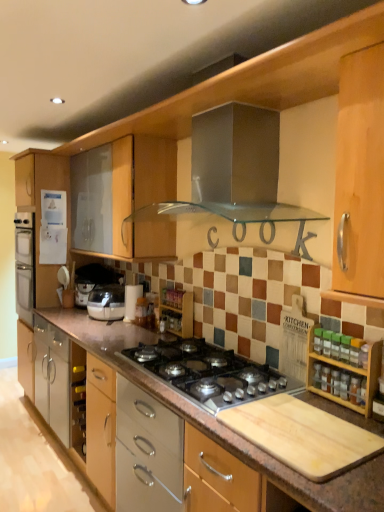
I want to click on wooden spice rack at right, positioned as the 2th cabinetry in bottom-to-top order, so click(x=345, y=375).

The image size is (384, 512). What do you see at coordinates (177, 311) in the screenshot? I see `wooden spice rack at center` at bounding box center [177, 311].

The height and width of the screenshot is (512, 384). Describe the element at coordinates (107, 302) in the screenshot. I see `matte white blender at center` at that location.

The image size is (384, 512). I want to click on matte white blender at center, so click(x=107, y=302).

Describe the element at coordinates (53, 228) in the screenshot. This screenshot has width=384, height=512. I see `white paper refrigerator at left, the 3th appliance when ordered from front to back` at that location.

Where is `white paper towel holder at center, positioned as the 1th appliance in front-to-back order`? This screenshot has height=512, width=384. white paper towel holder at center, positioned as the 1th appliance in front-to-back order is located at coordinates (131, 300).

Can you tell me how much wooden spice rack at center and satin silver toaster at lower left, the 2th appliance in the bottom-to-top sequence, differ in facing direction?

1.28 degrees.

Which of these two, wooden spice rack at center or satin silver toaster at lower left, the 2th appliance in the bottom-to-top sequence, is wider?

With larger width is satin silver toaster at lower left, the 2th appliance in the bottom-to-top sequence.

Where is `shelf that is in front of the satin silver toaster at lower left, the 2th appliance in the bottom-to-top sequence`? This screenshot has height=512, width=384. shelf that is in front of the satin silver toaster at lower left, the 2th appliance in the bottom-to-top sequence is located at coordinates click(177, 311).

Is wooden spice rack at center next to satin silver toaster at lower left, arranged as the 2th appliance when viewed from the front, and touching it?

No, wooden spice rack at center is not beside satin silver toaster at lower left, arranged as the 2th appliance when viewed from the front.

Are satin silver gas stove at center and white paper towel holder at center, acting as the 3th appliance starting from the left, far apart?

No, there isn't a large distance between satin silver gas stove at center and white paper towel holder at center, acting as the 3th appliance starting from the left.

Is white paper towel holder at center, positioned as the 1th appliance in front-to-back order, completely or partially inside satin silver gas stove at center?

No, white paper towel holder at center, positioned as the 1th appliance in front-to-back order, is not a part of satin silver gas stove at center.

From the image's perspective, is satin silver gas stove at center beneath white paper towel holder at center, the first appliance when ordered from right to left?

Yes.

Considering the sizes of satin silver gas stove at center and white paper towel holder at center, acting as the 1th appliance starting from the bottom, in the image, is satin silver gas stove at center bigger or smaller than white paper towel holder at center, acting as the 1th appliance starting from the bottom,?

satin silver gas stove at center is bigger than white paper towel holder at center, acting as the 1th appliance starting from the bottom.

From a real-world perspective, which object stands above the other?

white paper refrigerator at left, arranged as the third appliance when ordered from the bottom.

Considering the sizes of objects matte silver cabinet at lower center, which is the 1th cabinetry in left-to-right order, and white paper refrigerator at left, the 1th appliance when ordered from top to bottom, in the image provided, who is bigger, matte silver cabinet at lower center, which is the 1th cabinetry in left-to-right order, or white paper refrigerator at left, the 1th appliance when ordered from top to bottom,?

Bigger between the two is matte silver cabinet at lower center, which is the 1th cabinetry in left-to-right order.

How distant is matte silver cabinet at lower center, the 2th cabinetry when ordered from front to back, from white paper refrigerator at left, the 3th appliance from the right?

matte silver cabinet at lower center, the 2th cabinetry when ordered from front to back, and white paper refrigerator at left, the 3th appliance from the right, are 1.37 meters apart.

From the image's perspective, starting from the white paper refrigerator at left, arranged as the third appliance when ordered from the bottom, which cabinetry is the 2nd one below? Please provide its 2D coordinates.

[(150, 431)]

Considering the sizes of white paper refrigerator at left, the 1th appliance when ordered from top to bottom, and satin silver gas stove at center in the image, is white paper refrigerator at left, the 1th appliance when ordered from top to bottom, wider or thinner than satin silver gas stove at center?

Clearly, white paper refrigerator at left, the 1th appliance when ordered from top to bottom, has less width compared to satin silver gas stove at center.

Measure the distance from white paper refrigerator at left, the 3th appliance when ordered from front to back, to satin silver gas stove at center.

→ white paper refrigerator at left, the 3th appliance when ordered from front to back, and satin silver gas stove at center are 1.73 meters apart from each other.

From a real-world perspective, is white paper refrigerator at left, the 1th appliance when ordered from top to bottom, positioned above or below satin silver gas stove at center?

In terms of real-world spatial position, white paper refrigerator at left, the 1th appliance when ordered from top to bottom, is above satin silver gas stove at center.

From the image's perspective, is white paper refrigerator at left, the 3th appliance from the right, on top of satin silver gas stove at center?

Indeed, from the image's perspective, white paper refrigerator at left, the 3th appliance from the right, is shown above satin silver gas stove at center.

Can we say matte white blender at center lies outside wooden spice rack at center?

Yes, matte white blender at center is outside of wooden spice rack at center.

Which of these two, matte white blender at center or wooden spice rack at center, is wider?

matte white blender at center is wider.

From the image's perspective, who appears lower, matte white blender at center or wooden spice rack at center?

From the image's view, wooden spice rack at center is below.

The height and width of the screenshot is (512, 384). What are the coordinates of `home appliance located above the wooden spice rack at center (from the image's perspective)` in the screenshot? It's located at (107, 302).

Between wooden spice rack at center and matte white blender at center, which one is positioned behind?

matte white blender at center is more distant.

Looking at this image, what's the angular difference between wooden spice rack at center and matte white blender at center's facing directions?

wooden spice rack at center and matte white blender at center are facing 1.28 degrees away from each other.

From the image's perspective, is wooden spice rack at center positioned above or below matte white blender at center?

From the image's perspective, wooden spice rack at center appears below matte white blender at center.

From a real-world perspective, does matte silver cabinet at lower center, the 2th cabinetry when ordered from front to back, sit lower than wooden spice rack at right, positioned as the 2th cabinetry in bottom-to-top order?

Indeed, from a real-world perspective, matte silver cabinet at lower center, the 2th cabinetry when ordered from front to back, is positioned beneath wooden spice rack at right, positioned as the 2th cabinetry in bottom-to-top order.

Is matte silver cabinet at lower center, the 2th cabinetry when ordered from front to back, facing towards wooden spice rack at right, marked as the first cabinetry in a right-to-left arrangement?

No, matte silver cabinet at lower center, the 2th cabinetry when ordered from front to back, is not aimed at wooden spice rack at right, marked as the first cabinetry in a right-to-left arrangement.

Is matte silver cabinet at lower center, the 2th cabinetry when ordered from front to back, touching wooden spice rack at right, positioned as the 2th cabinetry in bottom-to-top order?

There is a gap between matte silver cabinet at lower center, the 2th cabinetry when ordered from front to back, and wooden spice rack at right, positioned as the 2th cabinetry in bottom-to-top order.

Would you say matte silver cabinet at lower center, the 2th cabinetry when ordered from front to back, contains wooden spice rack at right, marked as the 1th cabinetry in a front-to-back arrangement?

That's incorrect, wooden spice rack at right, marked as the 1th cabinetry in a front-to-back arrangement, is not inside matte silver cabinet at lower center, the 2th cabinetry when ordered from front to back.

From the image's perspective, which appliance is the 2nd one above the wooden spice rack at center? Please provide its 2D coordinates.

[(92, 280)]

Locate an element on the screen. gas stove beneath the white paper towel holder at center, which is the third appliance from back to front (from a real-world perspective) is located at coordinates click(x=206, y=372).

When comparing their distances from satin silver gas stove at center, does matte white blender at center or white paper refrigerator at left, the 3th appliance from the right, seem further?

white paper refrigerator at left, the 3th appliance from the right.

Looking at the image, which one is located closer to wooden spice rack at center, white paper refrigerator at left, the 3th appliance when ordered from front to back, or white paper towel holder at center, acting as the 3th appliance starting from the left?

Among the two, white paper towel holder at center, acting as the 3th appliance starting from the left, is located nearer to wooden spice rack at center.

Estimate the real-world distances between objects in this image. Which object is further from matte silver cabinet at lower center, arranged as the second cabinetry when viewed from the top, wooden spice rack at right, positioned as the 2th cabinetry in bottom-to-top order, or white paper refrigerator at left, acting as the first appliance starting from the left?

white paper refrigerator at left, acting as the first appliance starting from the left.

Based on their spatial positions, is matte white blender at center or wooden spice rack at center further from matte silver cabinet at lower center, which is the 1th cabinetry in back-to-front order?

Among the two, matte white blender at center is located further to matte silver cabinet at lower center, which is the 1th cabinetry in back-to-front order.

Based on their spatial positions, is matte silver cabinet at lower center, the 2th cabinetry when ordered from front to back, or satin silver gas stove at center closer to white paper refrigerator at left, the first appliance from the back?

Among the two, matte silver cabinet at lower center, the 2th cabinetry when ordered from front to back, is located nearer to white paper refrigerator at left, the first appliance from the back.

Based on their spatial positions, is satin silver toaster at lower left, which is counted as the second appliance, starting from the right, or white paper towel holder at center, the first appliance when ordered from right to left, further from wooden spice rack at center?

Among the two, satin silver toaster at lower left, which is counted as the second appliance, starting from the right, is located further to wooden spice rack at center.

Consider the image. Looking at the image, which one is located closer to matte silver cabinet at lower center, which is the 1th cabinetry in back-to-front order, white paper towel holder at center, the first appliance when ordered from right to left, or wooden spice rack at center?

wooden spice rack at center.

Estimate the real-world distances between objects in this image. Which object is further from wooden spice rack at right, positioned as the 2th cabinetry in bottom-to-top order, satin silver toaster at lower left, positioned as the second appliance in left-to-right order, or satin silver gas stove at center?

satin silver toaster at lower left, positioned as the second appliance in left-to-right order, lies further to wooden spice rack at right, positioned as the 2th cabinetry in bottom-to-top order, than the other object.

Locate an element on the screen. This screenshot has width=384, height=512. home appliance between wooden spice rack at right, positioned as the second cabinetry in left-to-right order, and white paper refrigerator at left, the 1th appliance when ordered from top to bottom, from front to back is located at coordinates (107, 302).

Find the location of a particular element. This screenshot has width=384, height=512. home appliance between wooden spice rack at right, positioned as the second cabinetry in left-to-right order, and satin silver toaster at lower left, the 2th appliance in the bottom-to-top sequence, in the front-back direction is located at coordinates (107, 302).

Find the location of `home appliance located between wooden spice rack at center and satin silver toaster at lower left, the second appliance in the top-to-bottom sequence, in the depth direction`. home appliance located between wooden spice rack at center and satin silver toaster at lower left, the second appliance in the top-to-bottom sequence, in the depth direction is located at coordinates (107, 302).

You are a GUI agent. You are given a task and a screenshot of the screen. Output one action in this format:
    pyautogui.click(x=<x>, y=<y>)
    Task: Click on the appliance between matte white blender at center and satin silver toaster at lower left, arranged as the 2th appliance when viewed from the front, from front to back
    
    Given the screenshot: What is the action you would take?
    pyautogui.click(x=131, y=300)